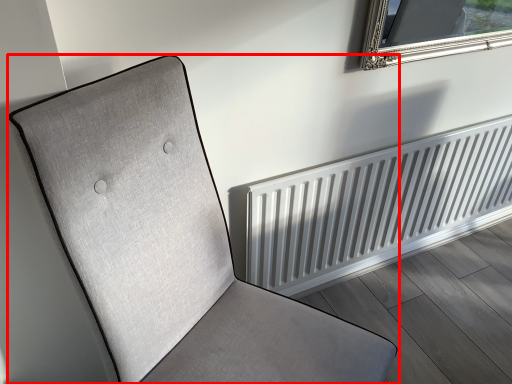
Question: Considering the relative positions of furniture (annotated by the red box) and radiator in the image provided, where is furniture (annotated by the red box) located with respect to the staircase?

Choices:
 (A) left
 (B) right

Answer: (A)